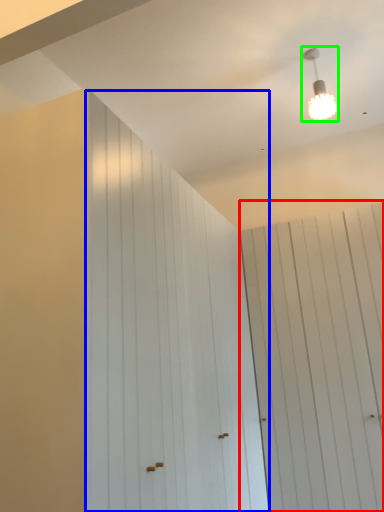
Question: Based on their relative distances, which object is nearer to barn door (highlighted by a red box)? Choose from barn door (highlighted by a blue box) and lamp (highlighted by a green box).

Choices:
 (A) barn door
 (B) lamp

Answer: (A)